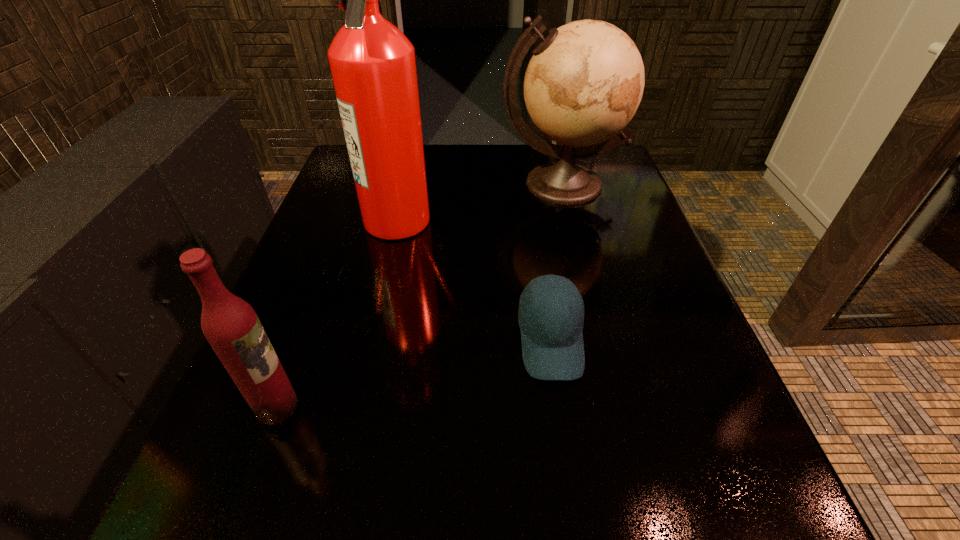
Locate an element on the screen. fire extinguisher is located at coordinates (373, 67).

The width and height of the screenshot is (960, 540). In order to click on the second object from left to right in this screenshot , I will do `click(373, 67)`.

You are a GUI agent. You are given a task and a screenshot of the screen. Output one action in this format:
    pyautogui.click(x=<x>, y=<y>)
    Task: Click on the globe
    This screenshot has height=540, width=960.
    Given the screenshot: What is the action you would take?
    tap(584, 82)

At what (x,y) coordinates should I click in order to perform the action: click on the third tallest object. Please return your answer as a coordinate pair (x, y). The width and height of the screenshot is (960, 540). Looking at the image, I should click on (231, 326).

Where is `liquor`? Image resolution: width=960 pixels, height=540 pixels. liquor is located at coordinates (231, 326).

The height and width of the screenshot is (540, 960). In order to click on the shortest object in this screenshot , I will do `click(552, 337)`.

Where is `the third farthest object`? The width and height of the screenshot is (960, 540). the third farthest object is located at coordinates (552, 337).

Find the location of a particular element. The width and height of the screenshot is (960, 540). vacant point located 0.230m at the nozzle of the fire extinguisher is located at coordinates (533, 219).

Where is `vacant space located 0.180m on the front-facing side of the third shortest object`? Image resolution: width=960 pixels, height=540 pixels. vacant space located 0.180m on the front-facing side of the third shortest object is located at coordinates (582, 265).

Identify the location of vacant space located 0.340m on the label of the second shortest object. The image size is (960, 540). (528, 407).